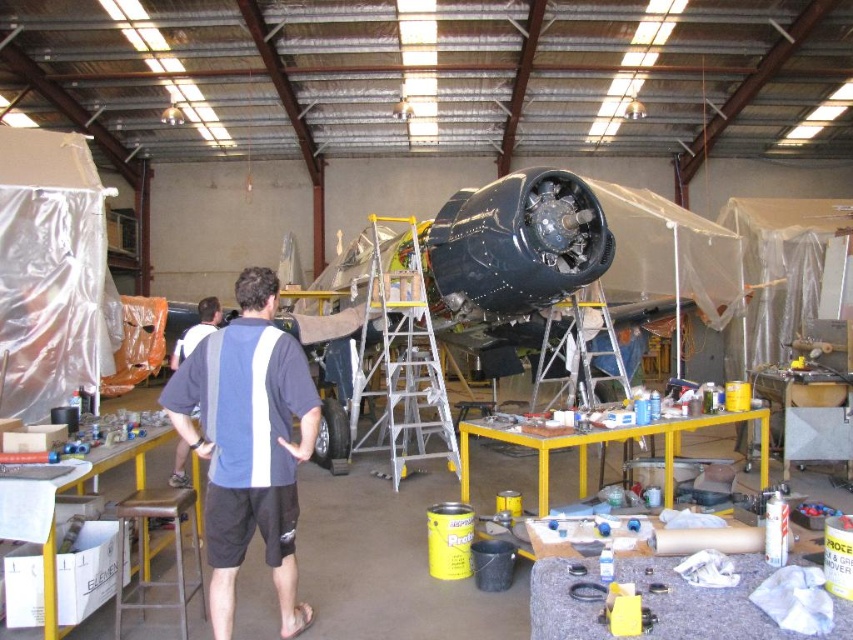
Is dark blue t-shirt at center taller than silver metallic ladder at center?

Correct, dark blue t-shirt at center is much taller as silver metallic ladder at center.

Can you confirm if dark blue t-shirt at center is wider than silver metallic ladder at center?

No, dark blue t-shirt at center is not wider than silver metallic ladder at center.

Which is behind, point (236, 346) or point (602, 346)?

Positioned behind is point (602, 346).

Locate an element on the screen. The height and width of the screenshot is (640, 853). dark blue t-shirt at center is located at coordinates (248, 444).

Between point (274, 493) and point (370, 227), which one is positioned behind?

The point (370, 227) is more distant.

Describe the element at coordinates (248, 444) in the screenshot. I see `dark blue t-shirt at center` at that location.

Identify the location of dark blue t-shirt at center. The height and width of the screenshot is (640, 853). (248, 444).

Measure the distance between point (x=283, y=595) and camera.

Point (x=283, y=595) is 3.27 meters away from camera.

Between dark blue t-shirt at center and white fabric shirt at center, which one appears on the left side from the viewer's perspective?

white fabric shirt at center is more to the left.

Where is `dark blue t-shirt at center`? The width and height of the screenshot is (853, 640). dark blue t-shirt at center is located at coordinates (248, 444).